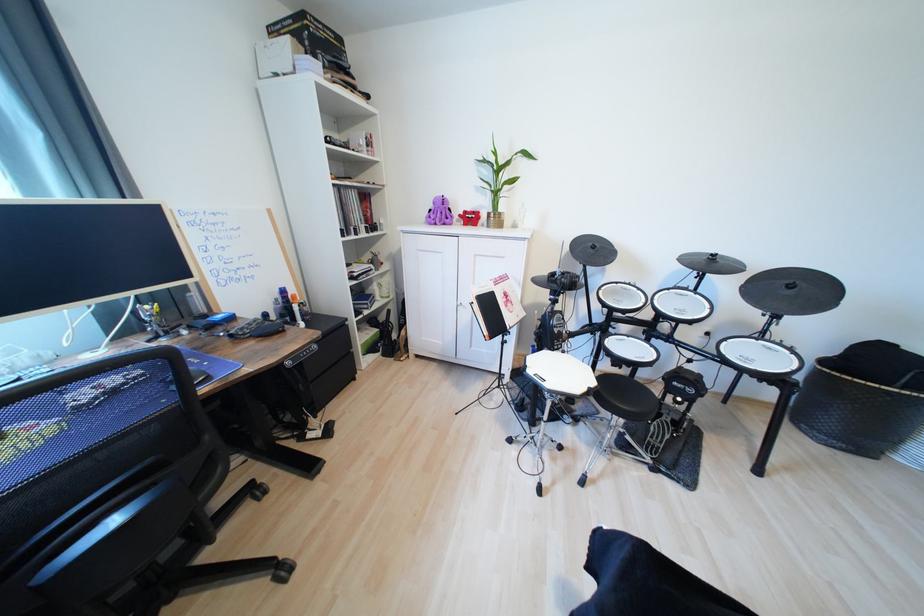
Describe the element at coordinates (629, 399) in the screenshot. I see `the drum stool sitting surface` at that location.